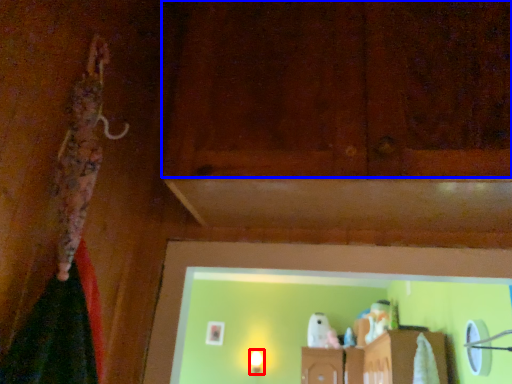
Question: Which object is further to the camera taking this photo, light fixture (highlighted by a red box) or wood (highlighted by a blue box)?

Choices:
 (A) light fixture
 (B) wood

Answer: (A)